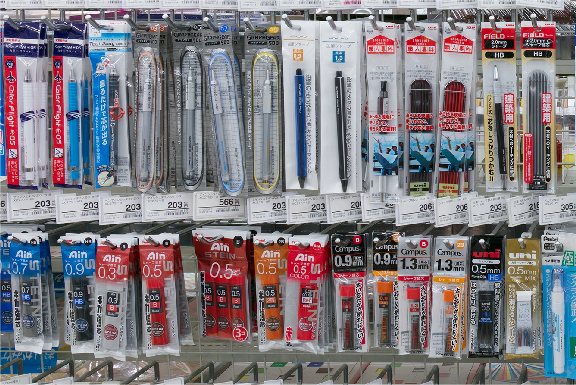
What are the coordinates of `metal shelving unit for pens and pencils` in the screenshot? It's located at (280, 172).